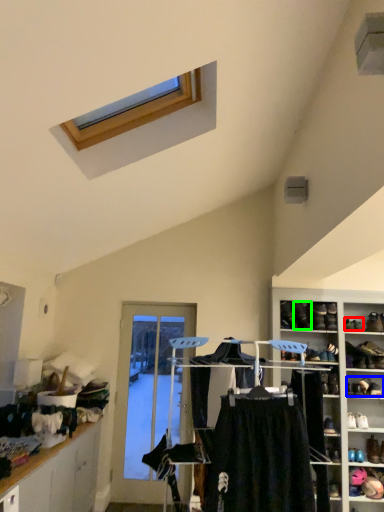
Question: Which object is positioned closest to shoe (highlighted by a red box)? Select from footwear (highlighted by a blue box) and shoe (highlighted by a green box).

Choices:
 (A) footwear
 (B) shoe

Answer: (B)